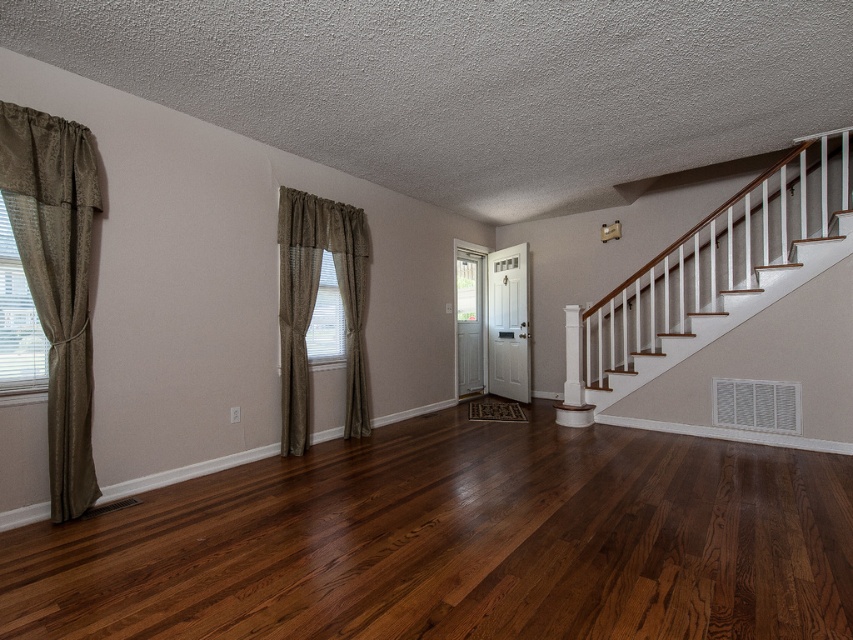
Question: Is satin beige curtain at left bigger than white wooden staircase at upper right?

Choices:
 (A) no
 (B) yes

Answer: (A)

Question: Is brown textured curtains at left to the right of white wooden staircase at upper right from the viewer's perspective?

Choices:
 (A) no
 (B) yes

Answer: (A)

Question: Which object appears farthest from the camera in this image?

Choices:
 (A) white glossy column at center
 (B) dark brown wood floor at center

Answer: (A)

Question: Based on their relative distances, which object is farther from the brown textured curtains at left?

Choices:
 (A) satin beige curtain at left
 (B) white glossy column at center
 (C) white textured blinds at left
 (D) dark brown wood floor at center

Answer: (B)

Question: Can you confirm if brown textured curtains at left is bigger than white textured blinds at left?

Choices:
 (A) yes
 (B) no

Answer: (A)

Question: Among these objects, which one is farthest from the camera?

Choices:
 (A) brown textured curtains at left
 (B) white glossy column at center
 (C) satin beige curtain at left

Answer: (B)